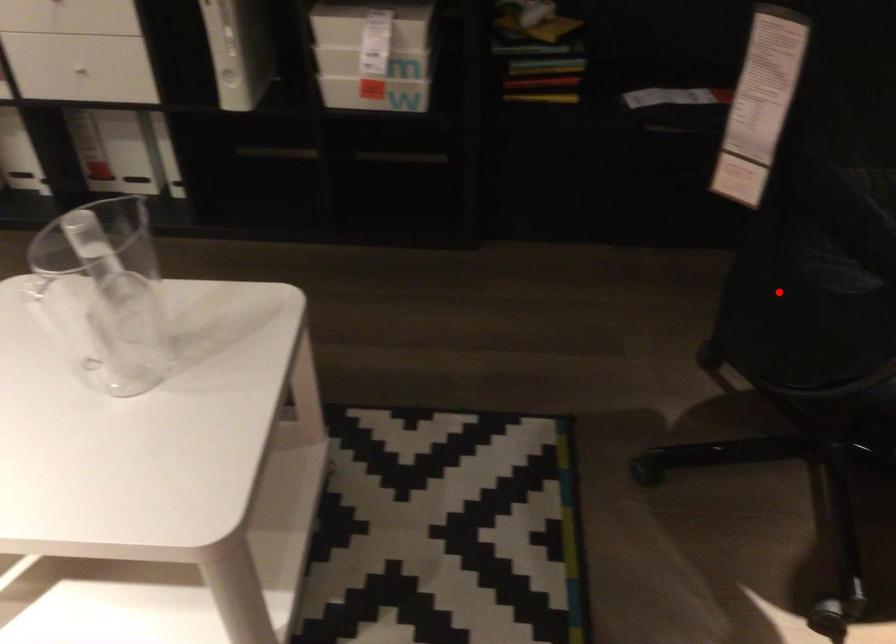
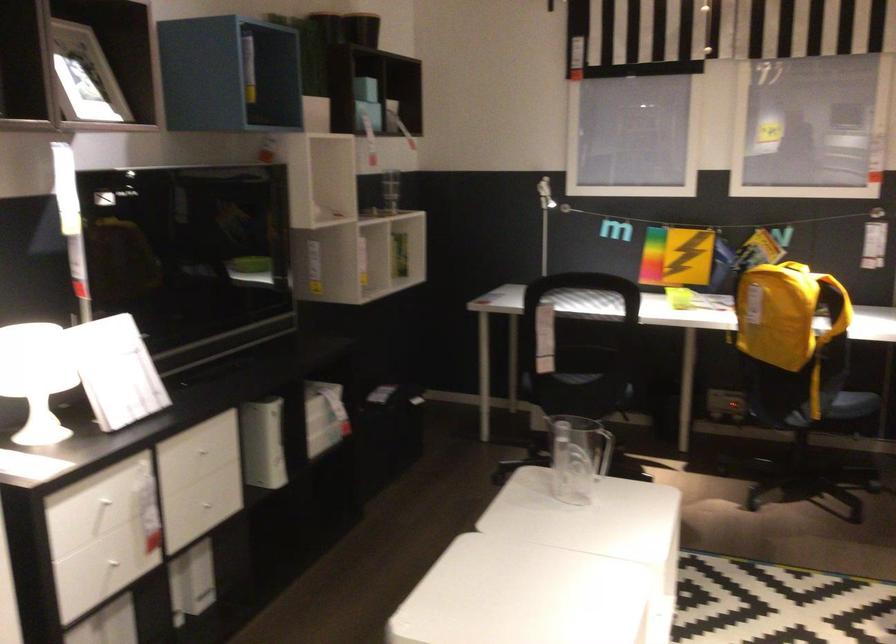
Where in the second image is the point corresponding to the highlighted location from the first image?

(571, 393)